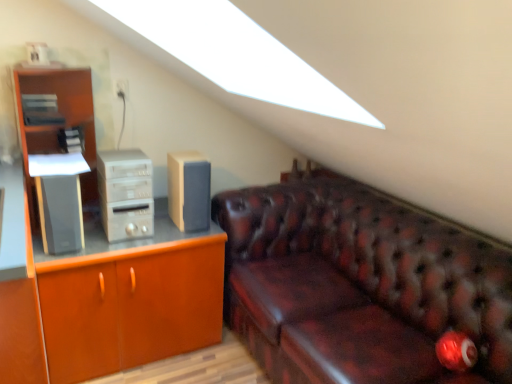
I want to click on empty space that is ontop of satin black speaker at left, which is counted as the second speaker, starting from the right, so click(57, 164).